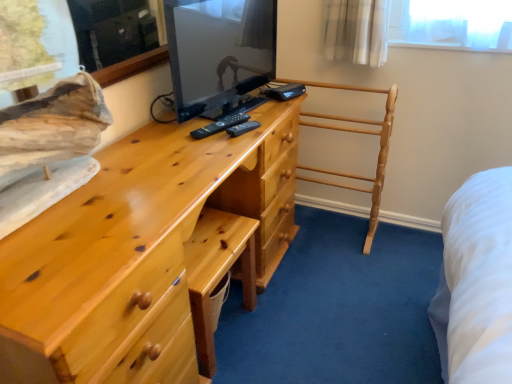
The image size is (512, 384). Identify the location of vacant space behind black plastic remote at center. (232, 108).